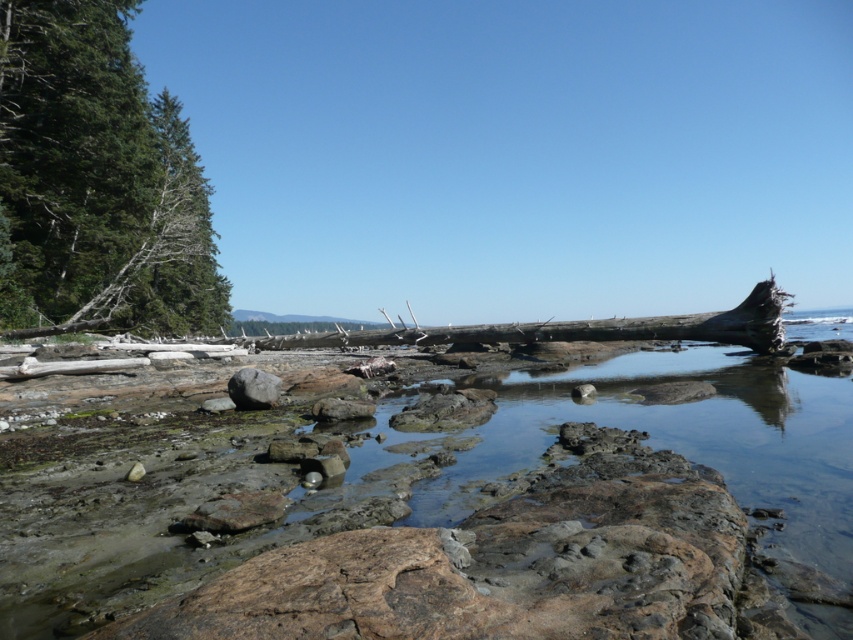
Is green rough bark tree at left bigger than gray smooth rock at center?

Yes.

Does point (99, 268) come in front of point (260, 388)?

No.

Is point (73, 221) behind point (239, 400)?

Yes, point (73, 221) is behind point (239, 400).

Image resolution: width=853 pixels, height=640 pixels. Find the location of `green rough bark tree at left`. green rough bark tree at left is located at coordinates (97, 180).